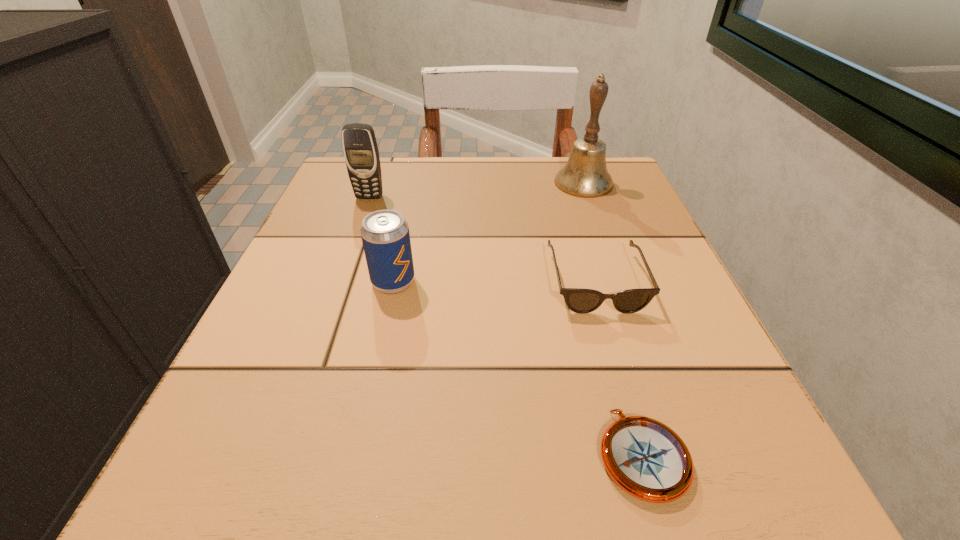
The image size is (960, 540). Identify the location of free point between the fourth tallest object and the tallest object. (589, 232).

You are a GUI agent. You are given a task and a screenshot of the screen. Output one action in this format:
    pyautogui.click(x=<x>, y=<y>)
    Task: Click on the vacant area that lies between the fourth object from right to left and the bell
    This screenshot has height=540, width=960.
    Given the screenshot: What is the action you would take?
    pyautogui.click(x=489, y=232)

You are a GUI agent. You are given a task and a screenshot of the screen. Output one action in this format:
    pyautogui.click(x=<x>, y=<y>)
    Task: Click on the free space between the fourth tallest object and the beer can
    This screenshot has width=960, height=540.
    Given the screenshot: What is the action you would take?
    pyautogui.click(x=494, y=281)

Locate an element on the screen. vacant space that is in between the sunglasses and the fourth shortest object is located at coordinates (483, 239).

Identify the location of vacant point located between the compass and the sunglasses. (619, 368).

Where is `blank region between the second shortest object and the second object from left to right`? Image resolution: width=960 pixels, height=540 pixels. blank region between the second shortest object and the second object from left to right is located at coordinates (494, 281).

Identify the location of blank region between the compass and the fourth object from right to left. (517, 368).

Identify the location of vacant area that lies between the cellular telephone and the second shortest object. (483, 239).

At what (x,y) coordinates should I click in order to perform the action: click on free space between the tallest object and the cellular telephone. Please return your answer as a coordinate pair (x, y). Looking at the image, I should click on (476, 190).

You are a GUI agent. You are given a task and a screenshot of the screen. Output one action in this format:
    pyautogui.click(x=<x>, y=<y>)
    Task: Click on the blank region between the bell and the nearest object
    The image size is (960, 540).
    Given the screenshot: What is the action you would take?
    (612, 319)